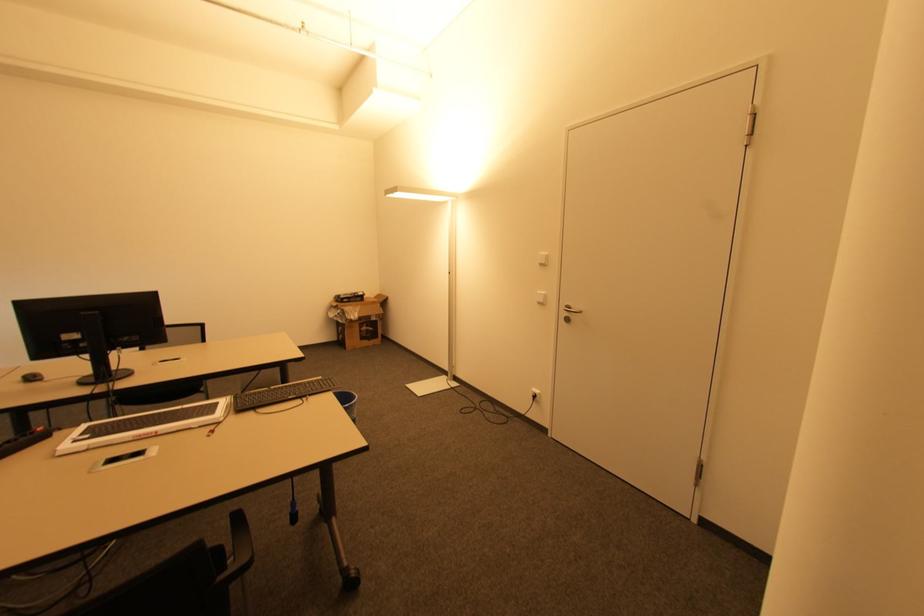
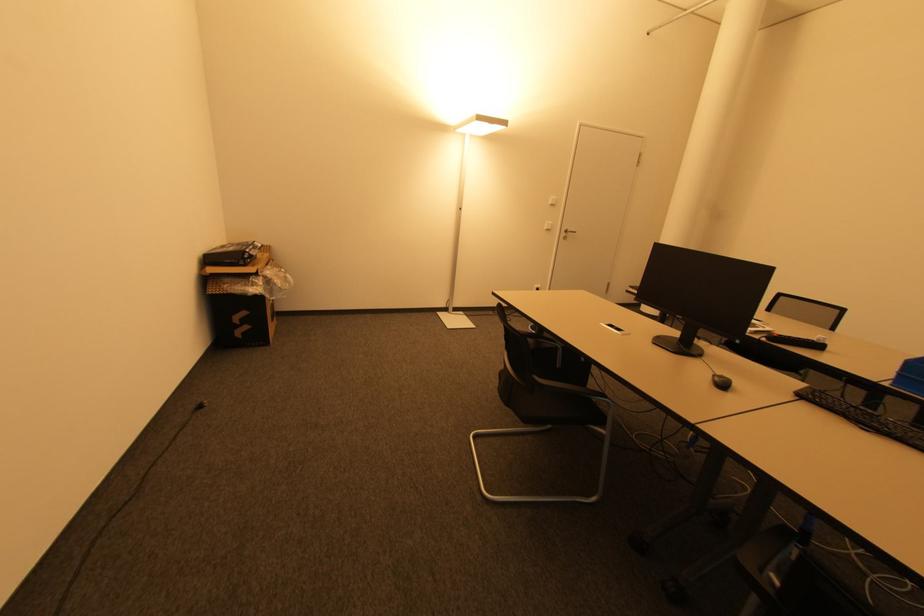
Find the pixel in the second image that matches the point at 347,302 in the first image.

(251, 262)